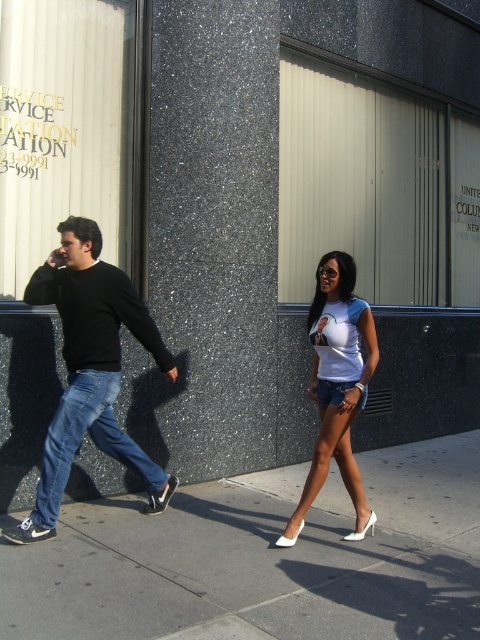
Question: Among these points, which one is farthest from the camera?

Choices:
 (A) (312, 493)
 (B) (400, 538)

Answer: (B)

Question: Does concrete sidewalk at center appear on the right side of white matte shorts at center?

Choices:
 (A) yes
 (B) no

Answer: (B)

Question: Estimate the real-world distances between objects in this image. Which object is farther from the concrete sidewalk at center?

Choices:
 (A) white matte shorts at center
 (B) black matte sweater at left

Answer: (B)

Question: Is concrete sidewalk at center wider than white matte shorts at center?

Choices:
 (A) no
 (B) yes

Answer: (B)

Question: Is concrete sidewalk at center to the left of black matte sweater at left from the viewer's perspective?

Choices:
 (A) yes
 (B) no

Answer: (B)

Question: Which point appears closest to the camera in this image?

Choices:
 (A) (162, 504)
 (B) (364, 320)

Answer: (B)